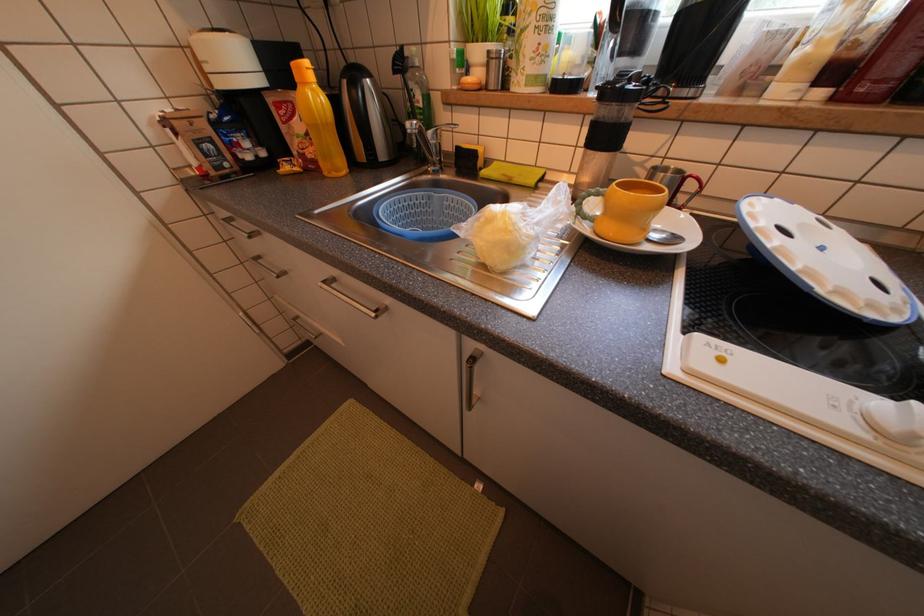
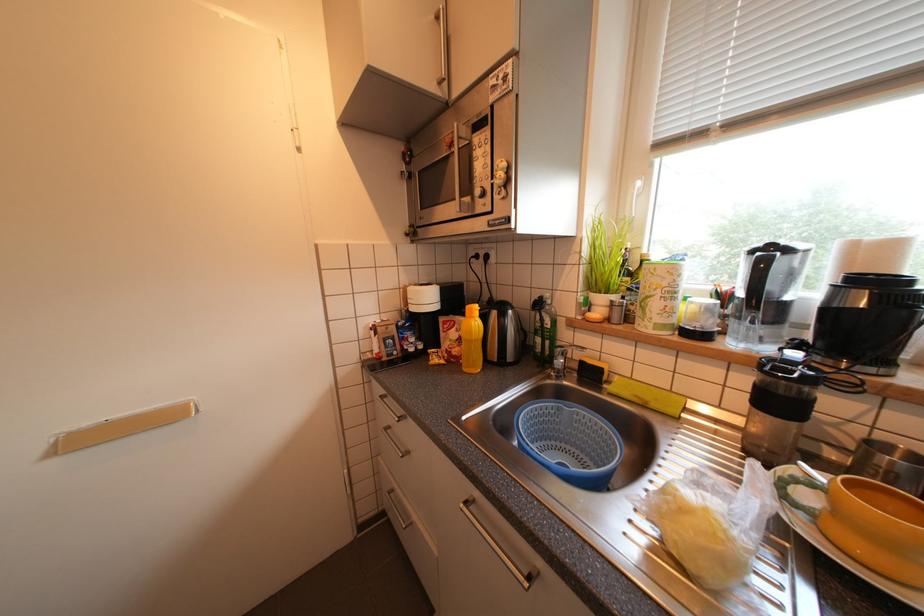
Based on the continuous images, in which direction is the camera rotating?

The camera rotated toward left-up.